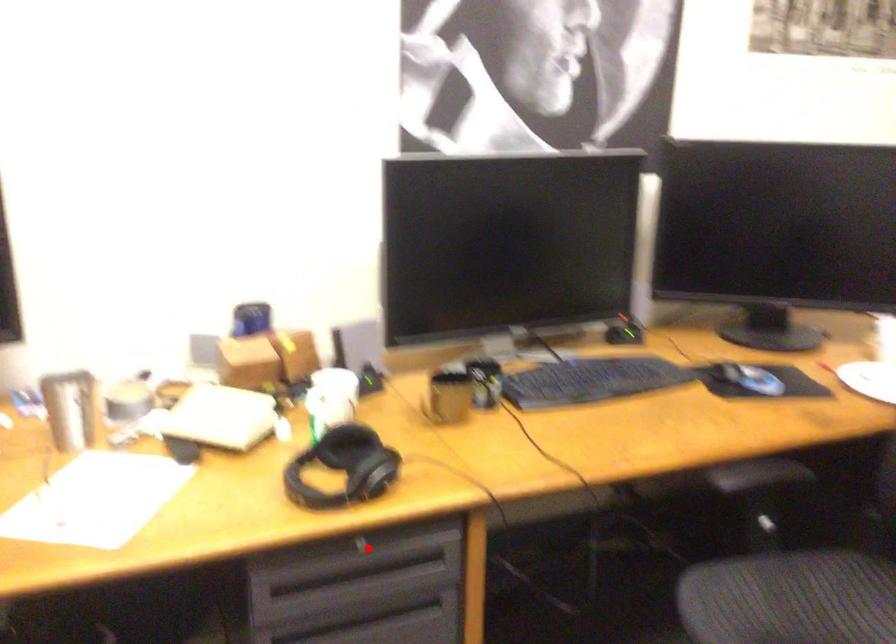
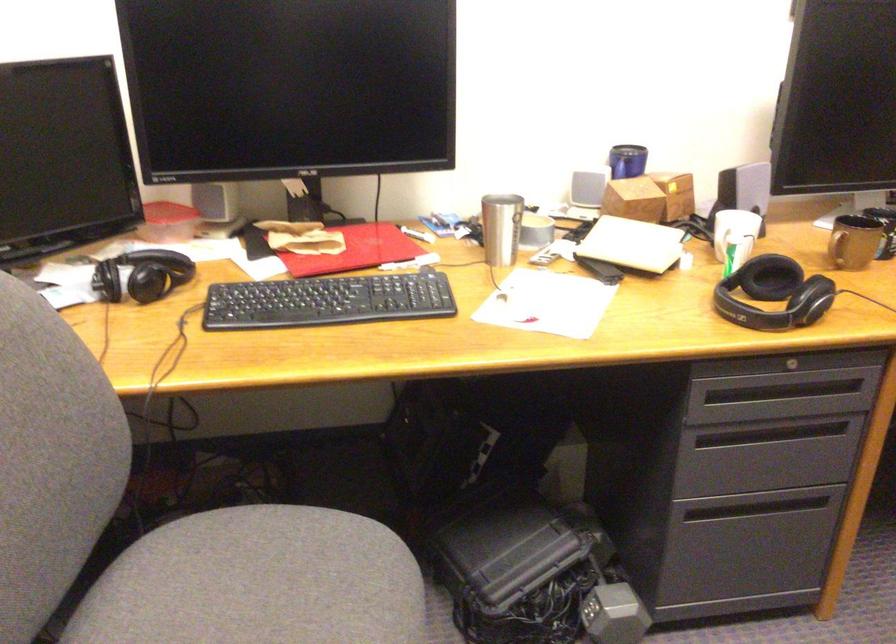
Where in the second image is the point corresponding to the highlighted location from the first image?

(794, 365)